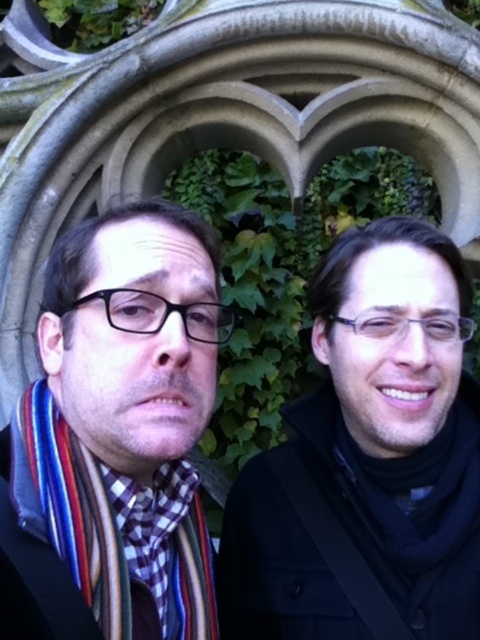
Looking at this image, you are standing in front of the stone structure and want to know which object is lower in position between the black matte jacket at right and the multicolored scarf at left. Can you tell me?

The black matte jacket at right is below the multicolored scarf at left, so the black matte jacket at right is lower in position.

You are a photographer trying to capture a clear shot of both the multicolored scarf at left and the black matte jacket at right. Based on their positions, which object is closer to the camera?

The black matte jacket at right is closer to the camera because the multicolored scarf at left is behind it.